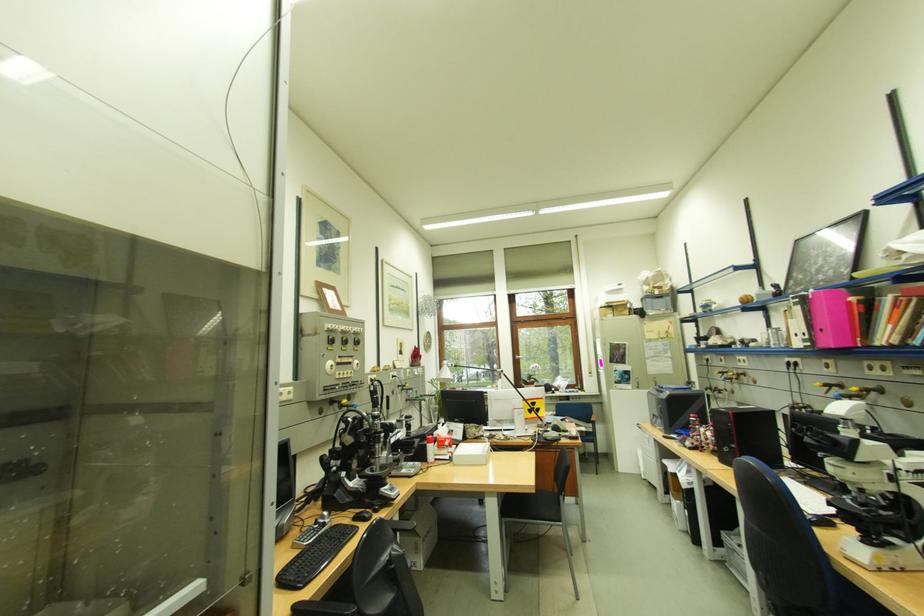
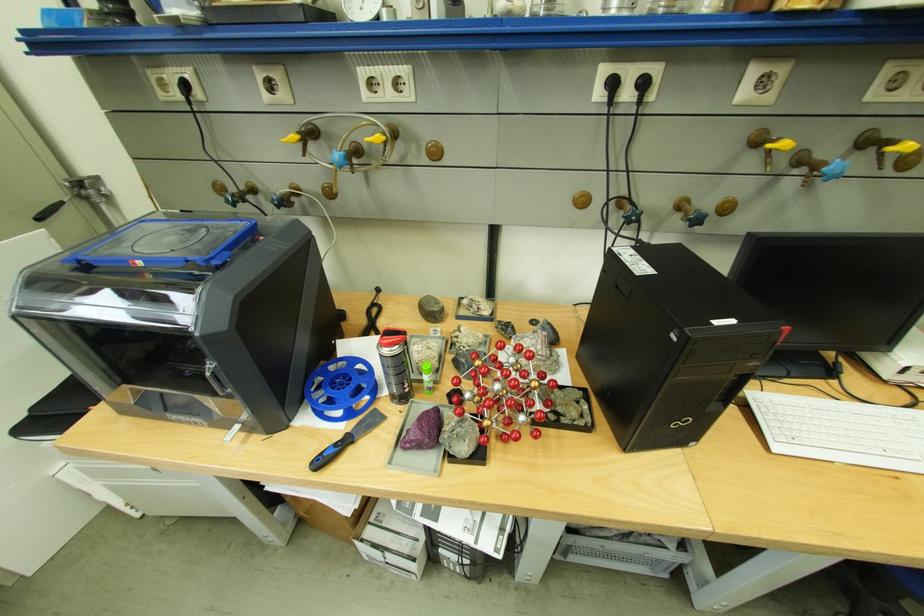
The point at [699,445] is marked in the first image. Where is the corresponding point in the second image?

(475, 448)